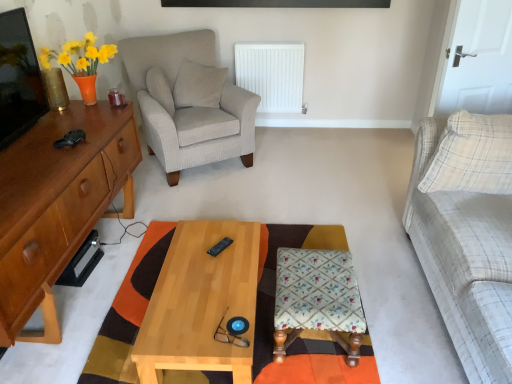
Measure the distance between white fabric pillow at upper center, which is counted as the 3th pillow, starting from the right, and camera.

They are 9.72 feet apart.

Describe the element at coordinates (160, 89) in the screenshot. I see `white fabric pillow at upper center, marked as the 1th pillow in a left-to-right arrangement` at that location.

Describe the element at coordinates (467, 234) in the screenshot. The width and height of the screenshot is (512, 384). I see `plaid fabric couch at right` at that location.

In the scene shown: What is the approximate width of white plastic radiator at center?

It is 5.47 inches.

This screenshot has height=384, width=512. What do you see at coordinates (202, 301) in the screenshot? I see `light wood/texture coffee table at center` at bounding box center [202, 301].

This screenshot has height=384, width=512. Identify the location of light wood/texture coffee table at center. (202, 301).

What is the approximate height of yellow matte vase at upper left?

It is 40.02 centimeters.

The image size is (512, 384). Identify the location of white fabric pillow at upper center, placed as the second pillow when sorted from back to front. (160, 89).

Considering the points (177, 67) and (194, 68), which point is in front, point (177, 67) or point (194, 68)?

The point (177, 67) is closer.

How much distance is there between light gray textured armchair at center and checkered fabric pillow at upper center, which is the 2th pillow in right-to-left order?

They are 6.68 inches apart.

From a real-world perspective, is light gray textured armchair at center physically above checkered fabric pillow at upper center, the first pillow viewed from the back?

No, from a real-world perspective, light gray textured armchair at center is not on top of checkered fabric pillow at upper center, the first pillow viewed from the back.

Is light wood/texture coffee table at center facing away from gold metallic vase at left?

No, gold metallic vase at left is not at the back of light wood/texture coffee table at center.

From the image's perspective, is light wood/texture coffee table at center on gold metallic vase at left?

No, from the image's perspective, light wood/texture coffee table at center is not above gold metallic vase at left.

Is light wood/texture coffee table at center not close to gold metallic vase at left?

light wood/texture coffee table at center is positioned a significant distance from gold metallic vase at left.

Looking at the image, does checkered fabric pillow at upper center, the third pillow in the front-to-back sequence, seem bigger or smaller compared to matte wood dresser at left?

checkered fabric pillow at upper center, the third pillow in the front-to-back sequence, is smaller than matte wood dresser at left.

Can you tell me how much checkered fabric pillow at upper center, which is the second pillow from left to right, and matte wood dresser at left differ in facing direction?

They differ by 97.2 degrees in their facing directions.

From a real-world perspective, between checkered fabric pillow at upper center, the first pillow viewed from the back, and matte wood dresser at left, who is vertically higher?

In real-world perspective, checkered fabric pillow at upper center, the first pillow viewed from the back, is above.

Is light wood/texture coffee table at center outside of checkered fabric pillow at upper center, the third pillow in the front-to-back sequence?

Yes, light wood/texture coffee table at center is located beyond the bounds of checkered fabric pillow at upper center, the third pillow in the front-to-back sequence.

Is light wood/texture coffee table at center facing away from checkered fabric pillow at upper center, the third pillow in the front-to-back sequence?

No, light wood/texture coffee table at center is not facing away from checkered fabric pillow at upper center, the third pillow in the front-to-back sequence.

From a real-world perspective, between light wood/texture coffee table at center and checkered fabric pillow at upper center, the first pillow viewed from the back, who is vertically higher?

From a 3D spatial view, checkered fabric pillow at upper center, the first pillow viewed from the back, is above.

How different are the orientations of light wood/texture coffee table at center and checkered fabric pillow at upper center, the third pillow in the front-to-back sequence, in degrees?

The angular difference between light wood/texture coffee table at center and checkered fabric pillow at upper center, the third pillow in the front-to-back sequence, is 99.7 degrees.

How many degrees apart are the facing directions of yellow matte vase at upper left and plaid fabric couch at right?

There is a 179-degree angle between the facing directions of yellow matte vase at upper left and plaid fabric couch at right.

Can you confirm if yellow matte vase at upper left is wider than plaid fabric couch at right?

Incorrect, the width of yellow matte vase at upper left does not surpass that of plaid fabric couch at right.

Which object is positioned more to the left, yellow matte vase at upper left or plaid fabric couch at right?

yellow matte vase at upper left.

This screenshot has width=512, height=384. In order to click on houseplant on the left of plaid fabric couch at right in this screenshot , I will do `click(81, 62)`.

Locate an element on the screen. vase behind the matte wood dresser at left is located at coordinates (55, 88).

Can you confirm if matte wood dresser at left is wider than gold metallic vase at left?

Yes, matte wood dresser at left is wider than gold metallic vase at left.

Is matte wood dresser at left not close to gold metallic vase at left?

matte wood dresser at left is near gold metallic vase at left, not far away.

Is checkered fabric pillow at upper center, which is the 2th pillow in right-to-left order, oriented towards light wood/texture coffee table at center?

Yes, checkered fabric pillow at upper center, which is the 2th pillow in right-to-left order, faces towards light wood/texture coffee table at center.

Which object is positioned more to the right, checkered fabric pillow at upper center, the third pillow in the front-to-back sequence, or light wood/texture coffee table at center?

light wood/texture coffee table at center.

Does checkered fabric pillow at upper center, the third pillow in the front-to-back sequence, have a smaller size compared to light wood/texture coffee table at center?

Yes.

You are a GUI agent. You are given a task and a screenshot of the screen. Output one action in this format:
    pyautogui.click(x=<x>, y=<y>)
    Task: Click on the chair on the left of checkered fabric pillow at upper center, which is the 2th pillow in right-to-left order
    
    Given the screenshot: What is the action you would take?
    pyautogui.click(x=189, y=101)

This screenshot has height=384, width=512. I want to click on coffee table lying in front of the gold metallic vase at left, so click(x=202, y=301).

From the image, which object appears to be farther from light gray textured armchair at center, white fabric pillow at upper center, marked as the 1th pillow in a left-to-right arrangement, or matte wood dresser at left?

matte wood dresser at left.

Which object lies further to the anchor point white plaid pillow at right, marked as the 3th pillow in a back-to-front arrangement, checkered fabric pillow at upper center, the third pillow in the front-to-back sequence, or white plastic radiator at center?

white plastic radiator at center is positioned further to the anchor white plaid pillow at right, marked as the 3th pillow in a back-to-front arrangement.

From the image, which object appears to be nearer to checkered fabric pillow at upper center, the third pillow in the front-to-back sequence, matte wood dresser at left or yellow matte vase at upper left?

Based on the image, yellow matte vase at upper left appears to be nearer to checkered fabric pillow at upper center, the third pillow in the front-to-back sequence.

Considering their positions, is floral fabric stool at center positioned further to plaid fabric couch at right than wooden table at center?

wooden table at center lies further to plaid fabric couch at right than the other object.

Estimate the real-world distances between objects in this image. Which object is further from white plastic radiator at center, white fabric pillow at upper center, the second pillow when ordered from front to back, or checkered fabric pillow at upper center, the third pillow in the front-to-back sequence?

white fabric pillow at upper center, the second pillow when ordered from front to back, is positioned further to the anchor white plastic radiator at center.

Looking at this image, when comparing their distances from plaid fabric couch at right, does checkered fabric pillow at upper center, the third pillow in the front-to-back sequence, or yellow matte vase at upper left seem closer?

The object closer to plaid fabric couch at right is checkered fabric pillow at upper center, the third pillow in the front-to-back sequence.

Based on their spatial positions, is yellow matte vase at upper left or checkered fabric pillow at upper center, the first pillow viewed from the back, closer to gold metallic vase at left?

Based on the image, yellow matte vase at upper left appears to be nearer to gold metallic vase at left.

When comparing their distances from yellow matte vase at upper left, does light wood/texture coffee table at center or checkered fabric pillow at upper center, which is the second pillow from left to right, seem further?

light wood/texture coffee table at center is positioned further to the anchor yellow matte vase at upper left.

Locate an element on the screen. The image size is (512, 384). chair between yellow matte vase at upper left and white fabric pillow at upper center, placed as the second pillow when sorted from back to front, along the z-axis is located at coordinates (189, 101).

Locate an element on the screen. This screenshot has height=384, width=512. houseplant between white fabric pillow at upper center, placed as the second pillow when sorted from back to front, and wooden table at center in the up-down direction is located at coordinates (81, 62).

I want to click on houseplant located between matte wood dresser at left and light gray textured armchair at center in the depth direction, so click(x=81, y=62).

The width and height of the screenshot is (512, 384). Identify the location of coffee table between light gray textured armchair at center and white plaid pillow at right, which ranks as the 1th pillow in front-to-back order, from left to right. (202, 301).